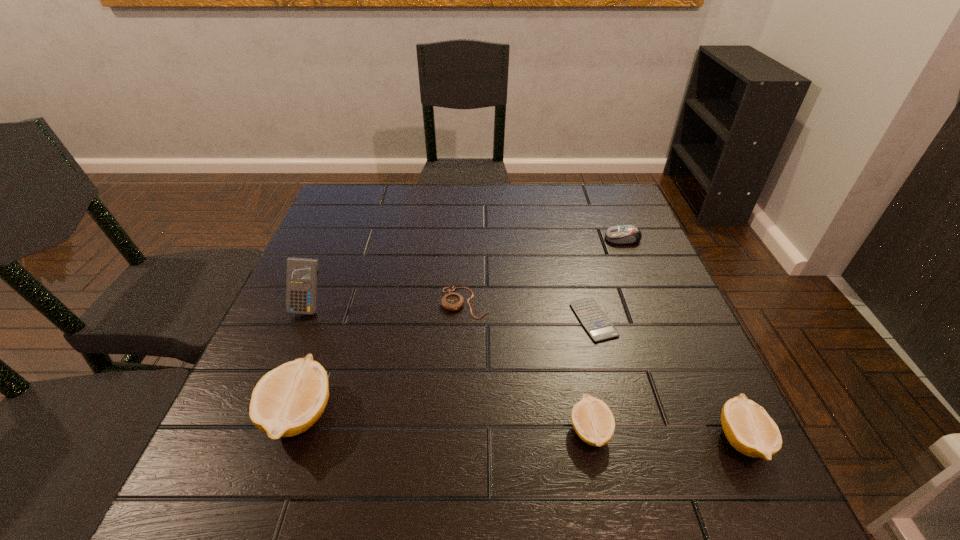
At what (x,y) coordinates should I click in order to perform the action: click on free location that satisfies the following two spatial constraints: 1. on the wheel side of the fifth tallest object; 2. on the left side of the fifth shortest object. Please return your answer as a coordinate pair (x, y). Looking at the image, I should click on (705, 440).